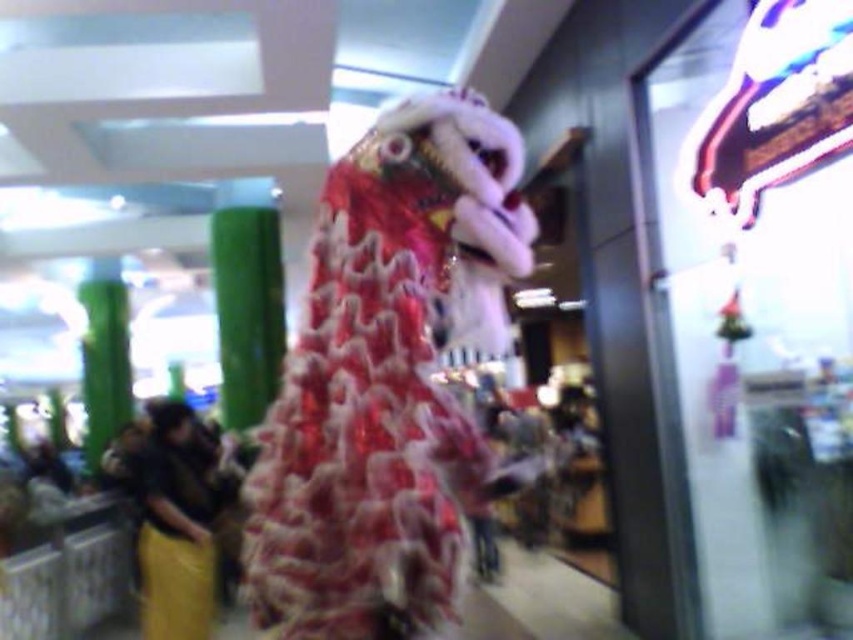
What do you see at coordinates (175, 525) in the screenshot?
I see `yellow fabric pants at lower left` at bounding box center [175, 525].

Which is behind, point (148, 630) or point (90, 381)?

The point (90, 381) is behind.

This screenshot has width=853, height=640. In order to click on yellow fabric pants at lower left in this screenshot , I will do `click(175, 525)`.

Between yellow fabric pants at lower left and green glossy pillar at center, which one has more height?

green glossy pillar at center

Between yellow fabric pants at lower left and green glossy pillar at center, which one is positioned higher?

green glossy pillar at center is above.

Which is behind, point (198, 449) or point (227, 212)?

Point (227, 212)

In order to click on yellow fabric pants at lower left in this screenshot , I will do `click(175, 525)`.

Is point (258, 328) closer to viewer compared to point (103, 416)?

Yes.

Can you confirm if green glossy pillar at center is positioned above green bamboo pillar at left?

Indeed, green glossy pillar at center is positioned over green bamboo pillar at left.

This screenshot has height=640, width=853. Describe the element at coordinates (247, 308) in the screenshot. I see `green glossy pillar at center` at that location.

You are a GUI agent. You are given a task and a screenshot of the screen. Output one action in this format:
    pyautogui.click(x=<x>, y=<y>)
    Task: Click on the green glossy pillar at center
    Image resolution: width=853 pixels, height=640 pixels.
    Given the screenshot: What is the action you would take?
    pyautogui.click(x=247, y=308)